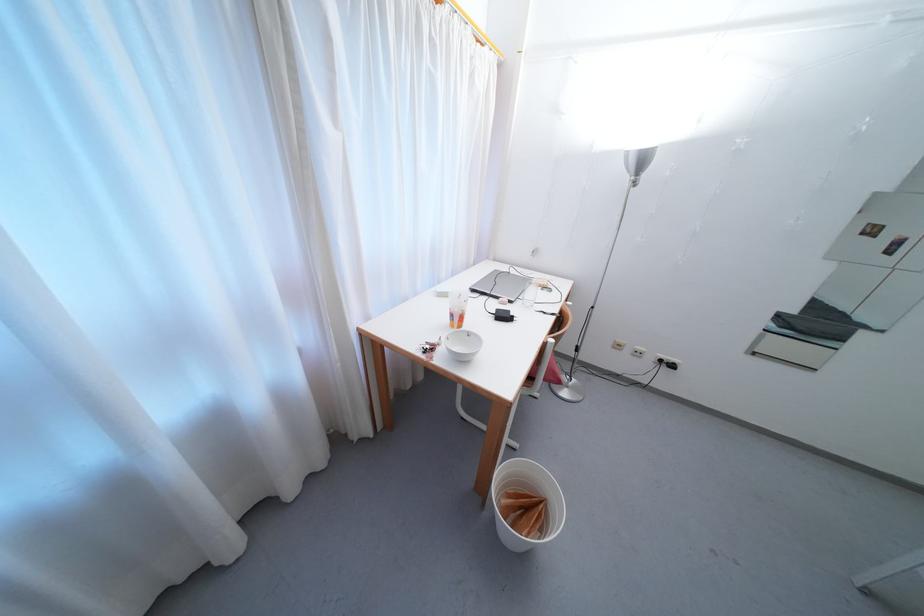
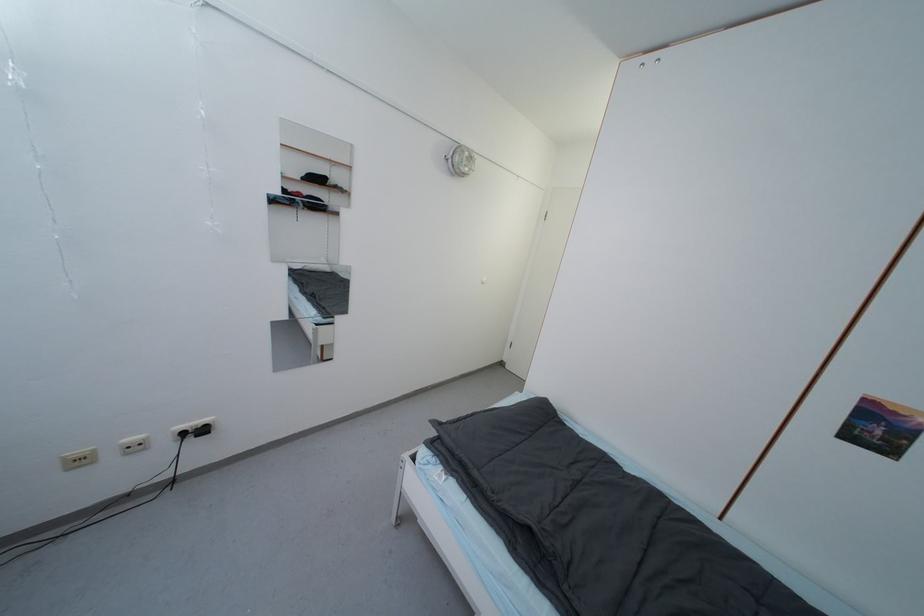
Find the pixel in the second image that matches the point at 622,349 in the first image.

(83, 464)